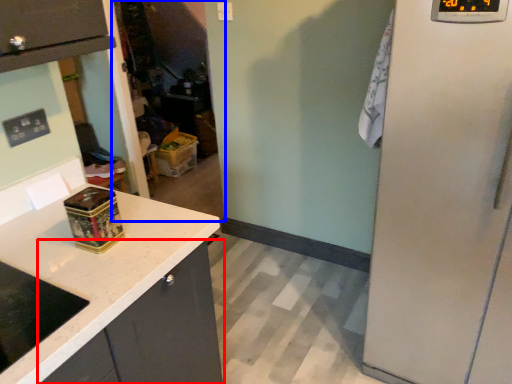
Question: Which point is further to the camera, cabinetry (highlighted by a red box) or glass door (highlighted by a blue box)?

Choices:
 (A) cabinetry
 (B) glass door

Answer: (B)